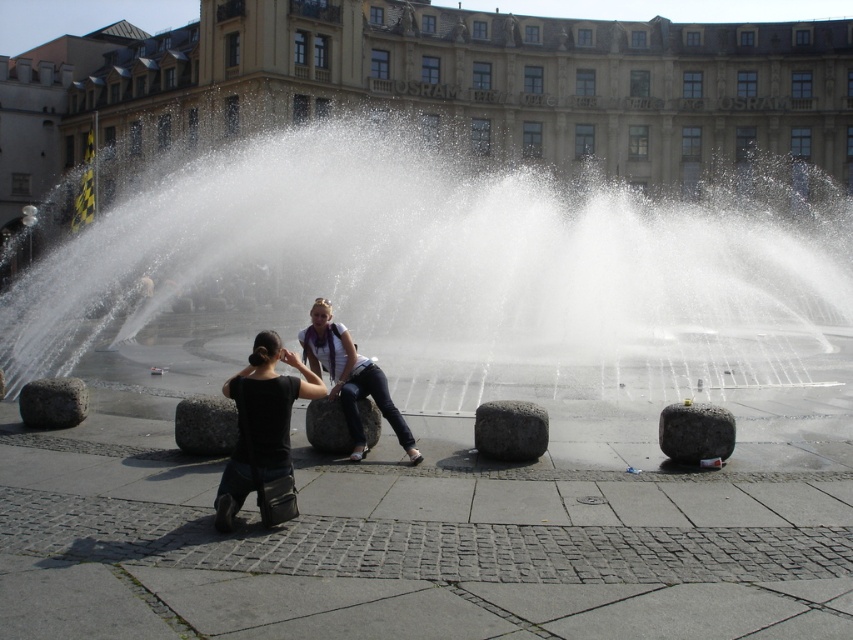
Question: Which of these objects is positioned farthest from the gray rough stone at lower left?

Choices:
 (A) gray granite stone at lower center
 (B) denim jeans at center
 (C) gray stone at center

Answer: (C)

Question: Is black matte shirt at lower left positioned at the back of gray granite stone at lower center?

Choices:
 (A) no
 (B) yes

Answer: (A)

Question: Can you confirm if black fabric couple at center is positioned below gray rough stone at center?

Choices:
 (A) yes
 (B) no

Answer: (A)

Question: Considering the real-world distances, which object is farthest from the clear water at fountain center?

Choices:
 (A) granite stone at lower right
 (B) black fabric couple at center
 (C) gray stone at center
 (D) black matte shirt at lower left

Answer: (B)

Question: Considering the real-world distances, which object is farthest from the gray stone at center?

Choices:
 (A) black matte shirt at lower left
 (B) gray rough stone at center
 (C) gray rough stone at lower left
 (D) gray granite stone at lower center

Answer: (C)

Question: Is black fabric couple at center in front of black matte shirt at lower left?

Choices:
 (A) no
 (B) yes

Answer: (A)